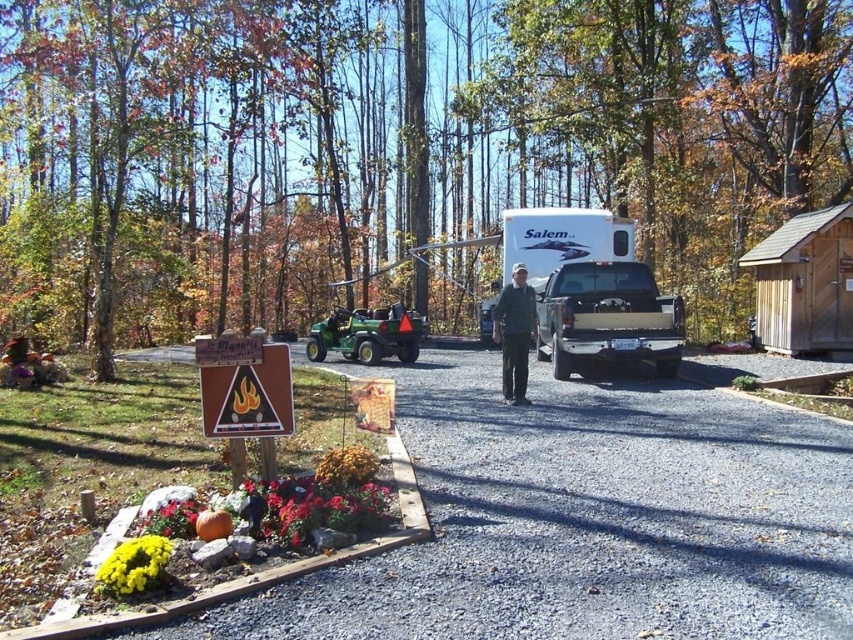
Question: Among these objects, which one is nearest to the camera?

Choices:
 (A) green plastic lawn mower at center
 (B) wooden cabin at right

Answer: (B)

Question: Does wooden cabin at right appear under brown wood sign at lower left?

Choices:
 (A) no
 (B) yes

Answer: (A)

Question: Observing the image, what is the correct spatial positioning of white matte truck at center in reference to green plastic lawn mower at center?

Choices:
 (A) below
 (B) above

Answer: (B)

Question: Which point is farther to the camera?

Choices:
 (A) white matte truck at center
 (B) green plastic lawn mower at center
 (C) wooden cabin at right

Answer: (B)

Question: Does wooden cabin at right have a greater width compared to green plastic lawn mower at center?

Choices:
 (A) no
 (B) yes

Answer: (B)

Question: Which point is farther from the camera taking this photo?

Choices:
 (A) (537, 314)
 (B) (521, 326)
 (C) (843, 305)
 (D) (389, 339)

Answer: (D)